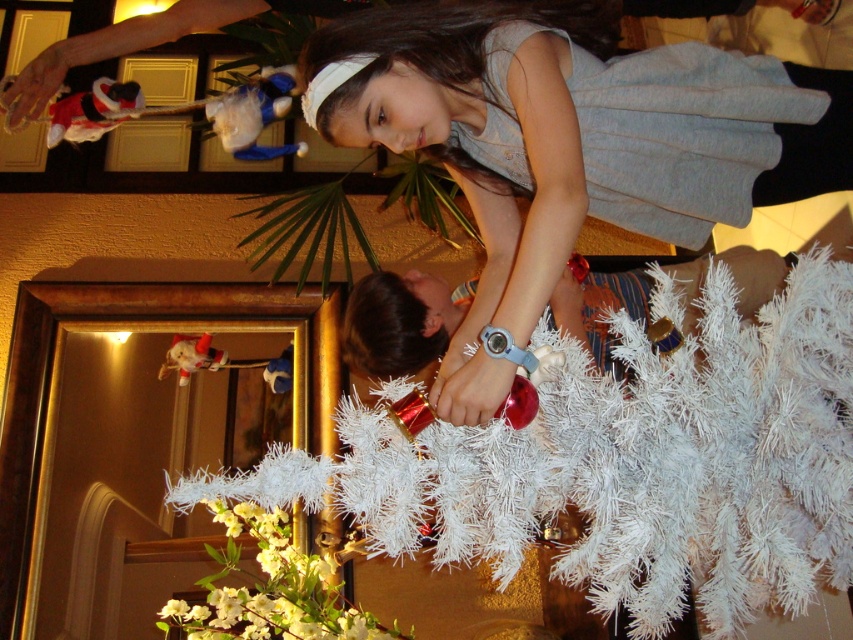
Question: Does white artificial tree at center have a smaller size compared to matte red santa at lower left?

Choices:
 (A) no
 (B) yes

Answer: (A)

Question: Which object is positioned closest to the velvet plush toy at center?

Choices:
 (A) velvet plush toy at upper left
 (B) white artificial tree at center
 (C) matte red santa at lower left
 (D) velvet santa claus at upper left

Answer: (C)

Question: Which of the following is the closest to the observer?

Choices:
 (A) (704, 221)
 (B) (108, 100)

Answer: (A)

Question: Is matte gray dress at upper center to the right of velvet plush toy at center from the viewer's perspective?

Choices:
 (A) no
 (B) yes

Answer: (B)

Question: Does matte gray dress at upper center have a greater width compared to matte red santa at lower left?

Choices:
 (A) yes
 (B) no

Answer: (A)

Question: Which of the following is the closest to the observer?

Choices:
 (A) velvet santa claus at upper left
 (B) matte red santa at lower left
 (C) velvet plush toy at center

Answer: (B)